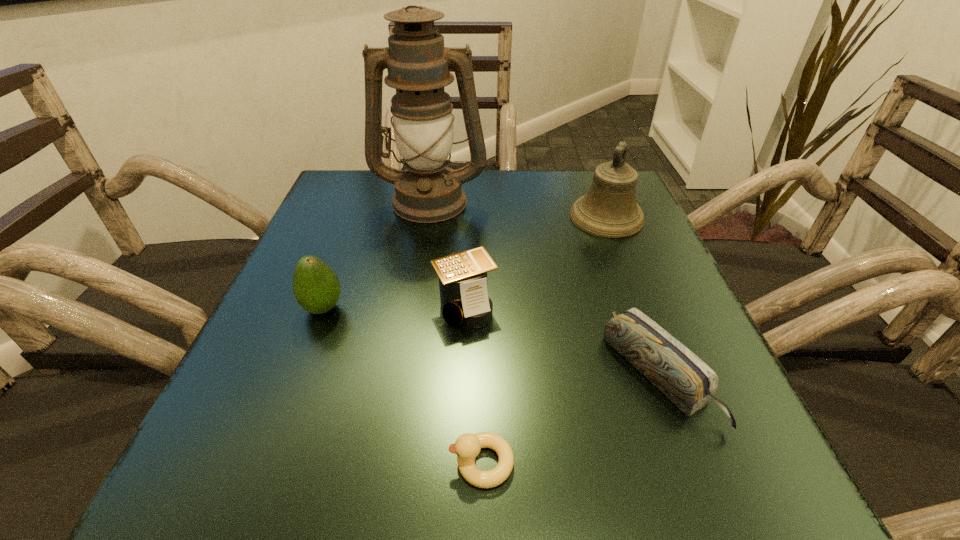
The image size is (960, 540). In order to click on free spot between the shortest object and the second shortest object in this screenshot , I will do `click(570, 420)`.

This screenshot has height=540, width=960. I want to click on free spot between the fourth tallest object and the shortest object, so click(x=473, y=384).

This screenshot has width=960, height=540. In order to click on free spot between the pencil box and the oil lamp in this screenshot , I will do `click(544, 288)`.

This screenshot has width=960, height=540. Identify the location of vacant region between the calculator and the duckling. (473, 384).

Find the location of a particular element. vacant space that's between the fourth tallest object and the shortest object is located at coordinates (473, 384).

What are the coordinates of `blank region between the duckling and the avocado` in the screenshot? It's located at (402, 386).

Locate an element on the screen. vacant space that's between the pencil box and the duckling is located at coordinates (570, 420).

The width and height of the screenshot is (960, 540). What are the coordinates of `free space between the tallest object and the fourth shortest object` in the screenshot? It's located at [376, 254].

Image resolution: width=960 pixels, height=540 pixels. Find the location of `the fourth closest object to the second shortest object`. the fourth closest object to the second shortest object is located at coordinates (418, 64).

Where is `the second closest object to the duckling`? This screenshot has height=540, width=960. the second closest object to the duckling is located at coordinates (464, 299).